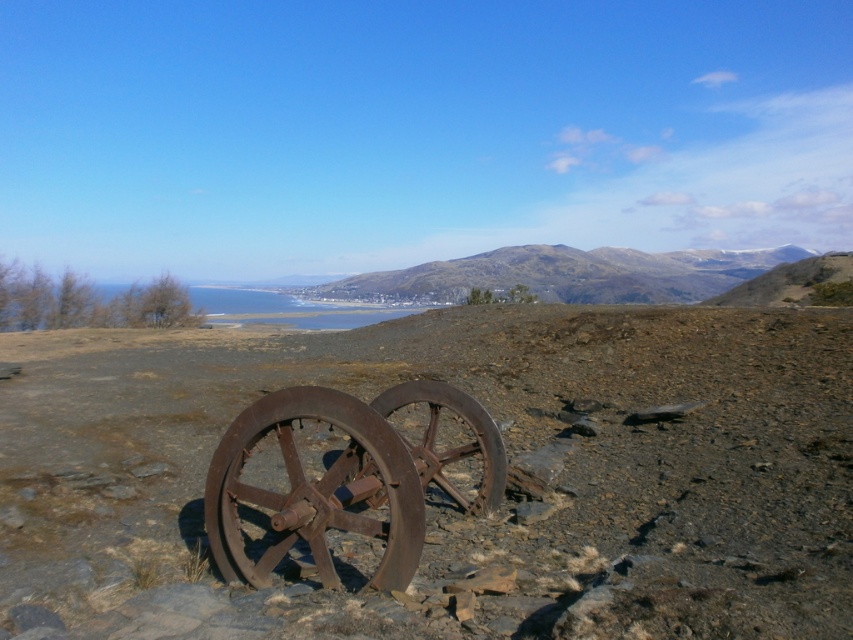
Which is in front, point (370, 454) or point (471, 456)?

Point (370, 454)

At what (x,y) coordinates should I click in order to perform the action: click on rusty metal wagon wheel at center. Please return your answer as a coordinate pair (x, y). This screenshot has width=853, height=640. Looking at the image, I should click on (314, 492).

Can you confirm if rusty metal wagon wheel at center is thinner than rustic brown hillside at center?

Correct, rusty metal wagon wheel at center's width is less than rustic brown hillside at center's.

Can you confirm if rusty metal wagon wheel at center is positioned to the left of rustic brown hillside at center?

Correct, you'll find rusty metal wagon wheel at center to the left of rustic brown hillside at center.

Is point (372, 460) closer to camera compared to point (709, 275)?

Yes, it is in front of point (709, 275).

The height and width of the screenshot is (640, 853). Identify the location of rusty metal wagon wheel at center. (314, 492).

Is point (486, 396) behind point (432, 296)?

That is False.

Is rusty metallic dirt field at center above rustic brown hillside at center?

Incorrect, rusty metallic dirt field at center is not positioned above rustic brown hillside at center.

Who is more forward, (312, 460) or (486, 285)?

Point (312, 460) is more forward.

The height and width of the screenshot is (640, 853). Find the location of `rusty metallic dirt field at center`. rusty metallic dirt field at center is located at coordinates (444, 476).